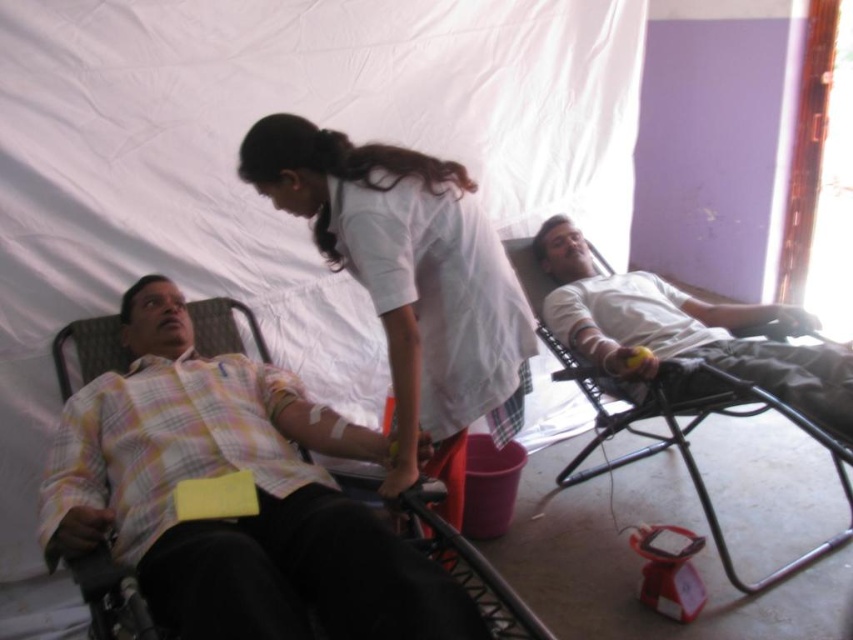
Question: Considering the relative positions of yellow plaid shirt at left and white matte shirt at right in the image provided, where is yellow plaid shirt at left located with respect to white matte shirt at right?

Choices:
 (A) below
 (B) above

Answer: (A)

Question: Does white smooth shirt at center lie behind white matte shirt at right?

Choices:
 (A) no
 (B) yes

Answer: (A)

Question: Which point appears farthest from the camera in this image?

Choices:
 (A) (523, 332)
 (B) (680, 381)

Answer: (B)

Question: In this image, where is yellow plaid shirt at left located relative to white smooth shirt at center?

Choices:
 (A) below
 (B) above

Answer: (A)

Question: Which point appears farthest from the camera in this image?

Choices:
 (A) (308, 508)
 (B) (490, 316)

Answer: (B)

Question: Which object appears closest to the camera in this image?

Choices:
 (A) yellow plaid shirt at left
 (B) white smooth shirt at center
 (C) white matte shirt at right

Answer: (A)